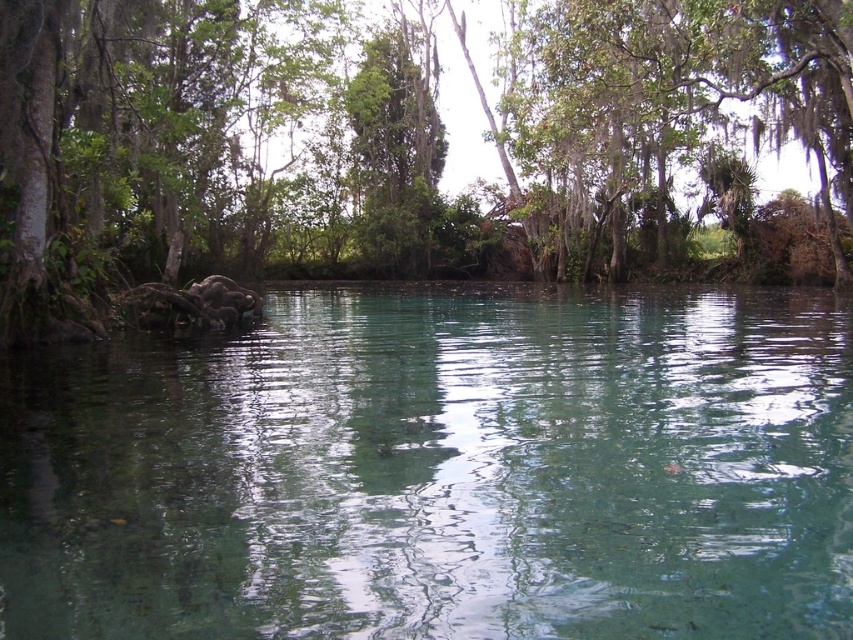
Question: Is clear water at center to the left of green leafy tree at center from the viewer's perspective?

Choices:
 (A) no
 (B) yes

Answer: (A)

Question: Does clear water at center come in front of green leafy tree at center?

Choices:
 (A) no
 (B) yes

Answer: (B)

Question: Is clear water at center below green leafy tree at center?

Choices:
 (A) no
 (B) yes

Answer: (B)

Question: Which point is farther from the camera taking this photo?

Choices:
 (A) (32, 532)
 (B) (537, 160)

Answer: (B)

Question: Which object appears closest to the camera in this image?

Choices:
 (A) green leafy tree at center
 (B) clear water at center

Answer: (B)